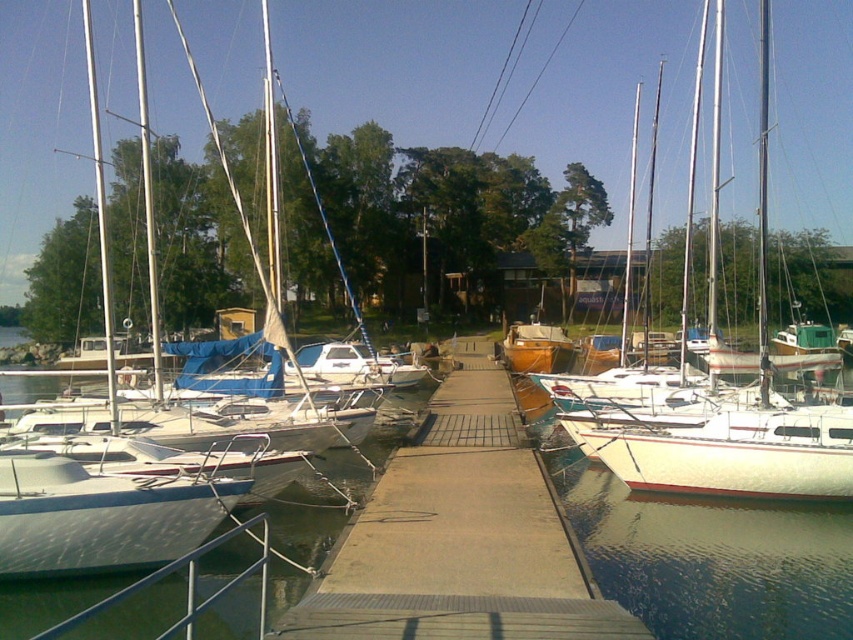
Question: Is clear water at dock center to the right of smooth concrete dock at center from the viewer's perspective?

Choices:
 (A) no
 (B) yes

Answer: (A)

Question: Does clear water at dock center have a greater width compared to smooth concrete dock at center?

Choices:
 (A) yes
 (B) no

Answer: (A)

Question: Can you confirm if clear water at dock center is bigger than smooth concrete dock at center?

Choices:
 (A) yes
 (B) no

Answer: (A)

Question: Which point is farther from the camera taking this photo?

Choices:
 (A) (490, 561)
 (B) (544, 424)

Answer: (B)